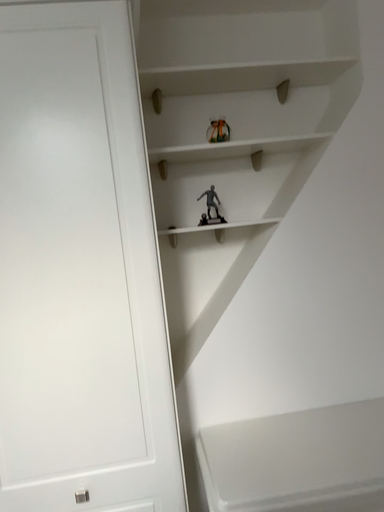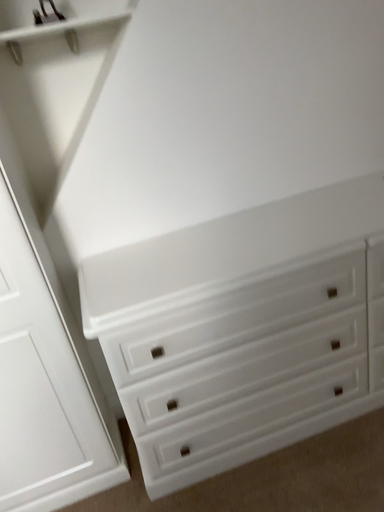
Question: How did the camera likely rotate when shooting the video?

Choices:
 (A) rotated right
 (B) rotated left

Answer: (A)